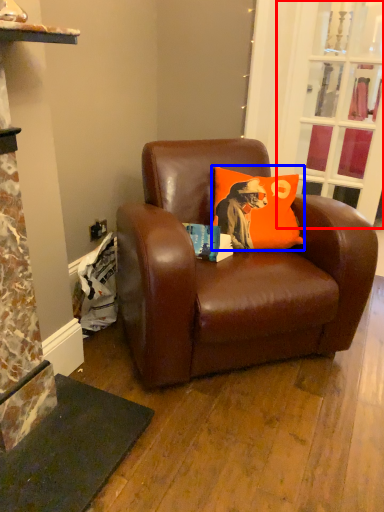
Question: Which object appears closest to the camera in this image, glass door (highlighted by a red box) or pillow (highlighted by a blue box)?

Choices:
 (A) glass door
 (B) pillow

Answer: (B)